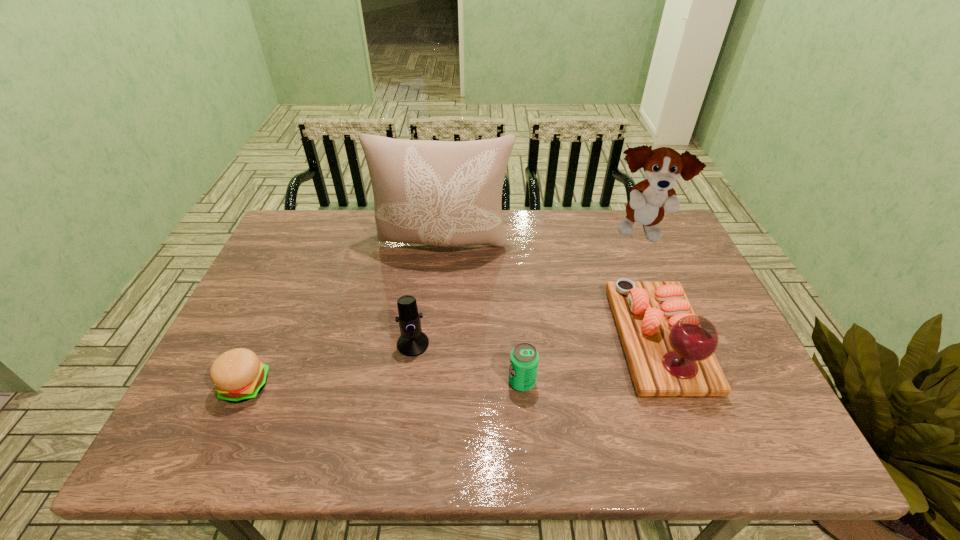
The image size is (960, 540). Identify the location of free region located 0.140m on the stand of the microphone. (404, 408).

I want to click on vacant space located on the front-facing side of the fifth tallest object, so click(x=388, y=382).

This screenshot has height=540, width=960. Find the location of `vacant space located 0.380m on the front-facing side of the fifth tallest object`. vacant space located 0.380m on the front-facing side of the fifth tallest object is located at coordinates (345, 382).

The width and height of the screenshot is (960, 540). What are the coordinates of `free space located 0.280m on the front-facing side of the fifth tallest object` in the screenshot? It's located at (388, 382).

Identify the location of free space located on the back of the leftmost object. (263, 347).

Identify the location of cushion that is at the far edge. The image size is (960, 540). (x=445, y=193).

Identify the location of puppy located at the far edge. (649, 199).

At what (x,y) coordinates should I click in order to perform the action: click on object that is at the left edge. Please return your answer as a coordinate pair (x, y). This screenshot has height=540, width=960. Looking at the image, I should click on (238, 375).

This screenshot has height=540, width=960. Identify the location of puppy at the right edge. (649, 199).

Locate an element on the screen. platter that is at the right edge is located at coordinates (670, 351).